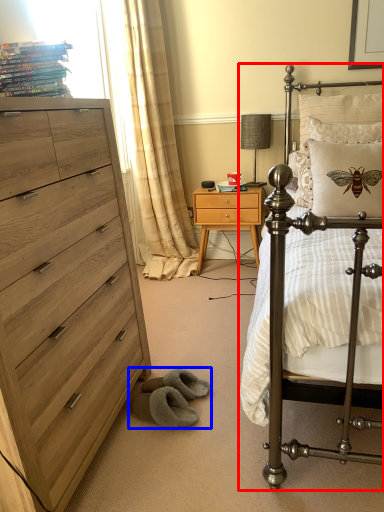
Question: Which object is closer to the camera taking this photo, bed (highlighted by a red box) or gray (highlighted by a blue box)?

Choices:
 (A) bed
 (B) gray

Answer: (A)